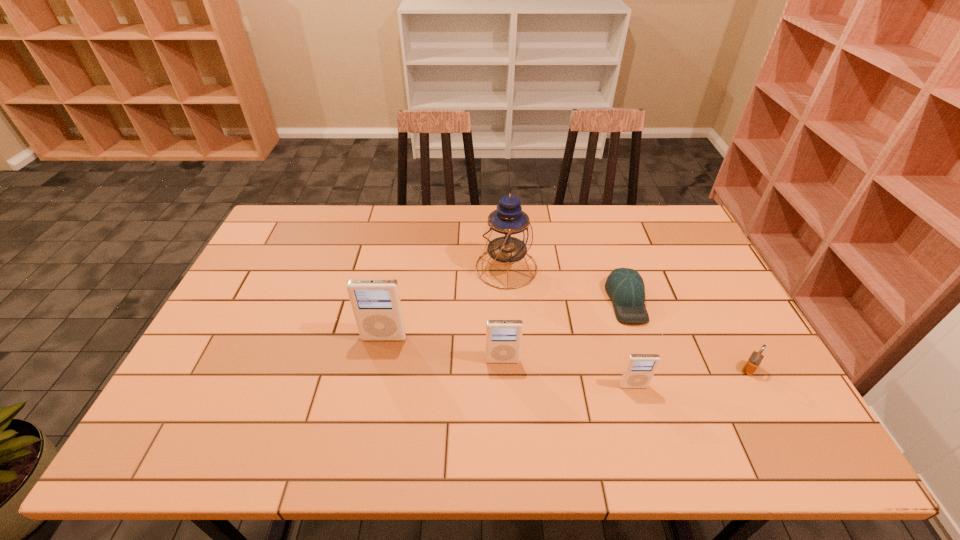
In order to click on free location located on the front-facing side of the fourth nearest object in this screenshot , I will do `click(371, 405)`.

Where is `vacant space located on the front-facing side of the second farthest iPod`? The height and width of the screenshot is (540, 960). vacant space located on the front-facing side of the second farthest iPod is located at coordinates (505, 406).

Find the location of `vacant position located 0.290m on the back of the rightmost object`. vacant position located 0.290m on the back of the rightmost object is located at coordinates (704, 284).

Identify the location of vacant space located on the front-facing side of the lantern. (368, 268).

Where is `free location located 0.340m on the front-facing side of the lantern`? free location located 0.340m on the front-facing side of the lantern is located at coordinates (368, 268).

Identify the location of free region located 0.360m on the front-facing side of the lantern. (362, 268).

Where is `vacant space situated on the left of the baseball cap`? The height and width of the screenshot is (540, 960). vacant space situated on the left of the baseball cap is located at coordinates (540, 300).

Find the location of a particular element. object that is at the near edge is located at coordinates (639, 369).

Where is `object at the right edge`? This screenshot has height=540, width=960. object at the right edge is located at coordinates pyautogui.click(x=753, y=362).

In order to click on free space at the far edge in this screenshot , I will do `click(387, 230)`.